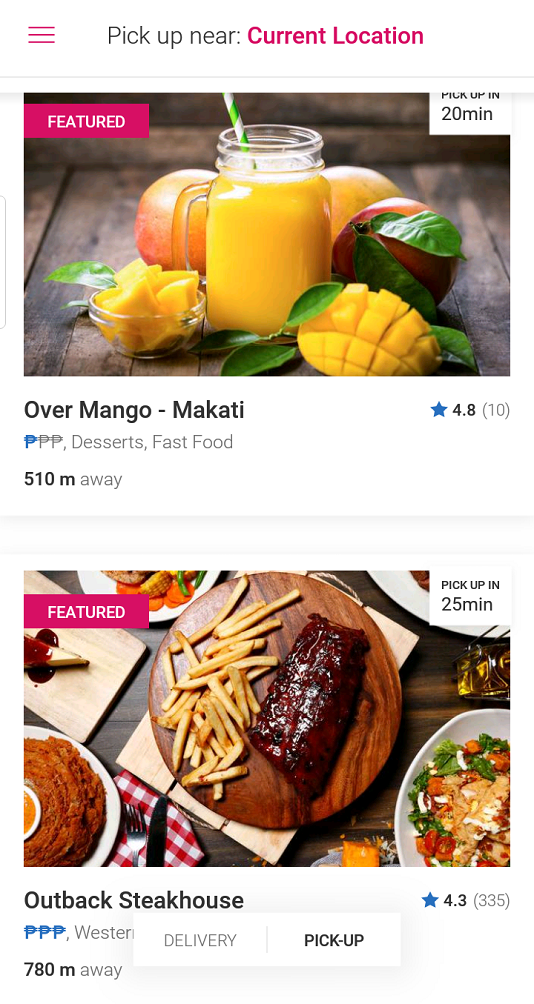
Where is `plate`? plate is located at coordinates (475, 730).